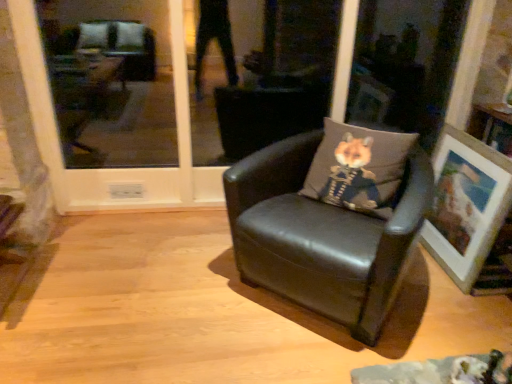
Question: Does gray fabric pillow with fox print at center contain transparent glass door at center?

Choices:
 (A) yes
 (B) no

Answer: (B)

Question: Is gray fabric pillow with fox print at center bigger than transparent glass door at center?

Choices:
 (A) no
 (B) yes

Answer: (A)

Question: Is gray fabric pillow with fox print at center oriented towards transparent glass door at center?

Choices:
 (A) no
 (B) yes

Answer: (A)

Question: Can you confirm if gray fabric pillow with fox print at center is shorter than transparent glass door at center?

Choices:
 (A) yes
 (B) no

Answer: (A)

Question: Considering the relative positions of gray fabric pillow with fox print at center and transparent glass door at center in the image provided, is gray fabric pillow with fox print at center in front of transparent glass door at center?

Choices:
 (A) no
 (B) yes

Answer: (B)

Question: Is gray fabric pillow with fox print at center at the left side of transparent glass door at center?

Choices:
 (A) yes
 (B) no

Answer: (B)

Question: Are black leather chair at center and wooden picture frame at right located far from each other?

Choices:
 (A) yes
 (B) no

Answer: (B)

Question: Does black leather chair at center appear on the left side of wooden picture frame at right?

Choices:
 (A) no
 (B) yes

Answer: (B)

Question: Does black leather chair at center have a larger size compared to wooden picture frame at right?

Choices:
 (A) no
 (B) yes

Answer: (B)

Question: Can you confirm if black leather chair at center is thinner than wooden picture frame at right?

Choices:
 (A) yes
 (B) no

Answer: (B)

Question: Can you confirm if black leather chair at center is shorter than wooden picture frame at right?

Choices:
 (A) no
 (B) yes

Answer: (A)

Question: Can we say black leather chair at center lies outside wooden picture frame at right?

Choices:
 (A) no
 (B) yes

Answer: (B)

Question: Is wooden picture frame at right located outside gray fabric pillow with fox print at center?

Choices:
 (A) no
 (B) yes

Answer: (B)